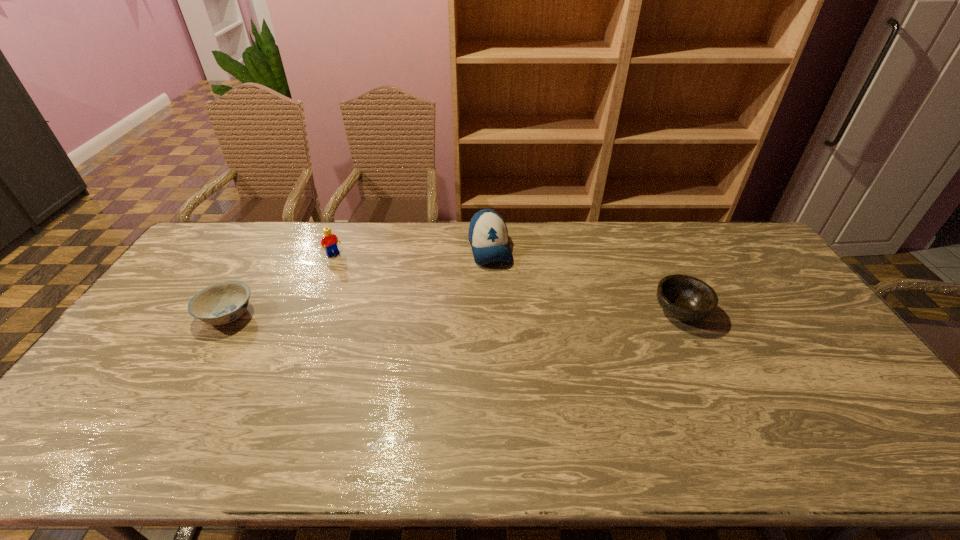
Identify the location of the left bowl. This screenshot has width=960, height=540. (224, 302).

Identify the location of the right bowl. (686, 298).

Locate an element on the screen. This screenshot has height=540, width=960. Lego is located at coordinates 330,240.

The width and height of the screenshot is (960, 540). In order to click on baseball cap in this screenshot , I will do `click(488, 235)`.

Locate an element on the screen. vacant space located 0.170m on the left of the leftmost object is located at coordinates (143, 314).

Locate an element on the screen. The height and width of the screenshot is (540, 960). vacant area situated on the right of the rightmost object is located at coordinates tap(760, 312).

The height and width of the screenshot is (540, 960). In order to click on free space located 0.270m on the front-facing side of the Lego in this screenshot , I will do `click(377, 298)`.

Where is `vacant region located 0.130m on the front-facing side of the Lego`? The image size is (960, 540). vacant region located 0.130m on the front-facing side of the Lego is located at coordinates (355, 276).

Find the location of a particular element. The height and width of the screenshot is (540, 960). vacant area situated on the front-facing side of the Lego is located at coordinates (348, 268).

Locate an element on the screen. free space located 0.290m on the front-facing side of the third object from left to right is located at coordinates (516, 333).